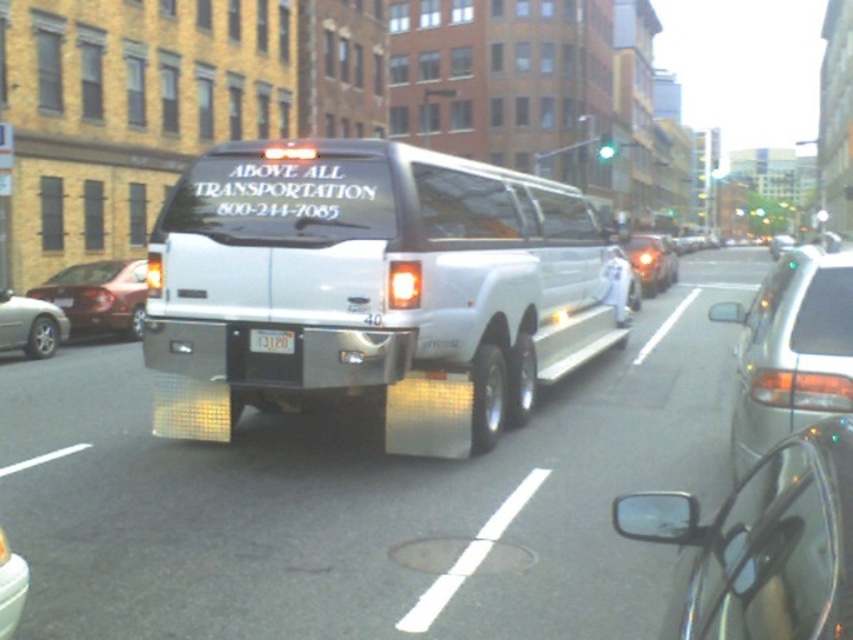
You are a delivery person who needs to load a tall package into one of the cars. Which car between the metallic silver sedan at right and the metallic red sedan at left would allow you to place the package without damaging the roof?

The metallic silver sedan at right has a greater height compared to the metallic red sedan at left, so it would allow you to place the tall package without damaging the roof.

You are a delivery person who needs to park your 2.5 meters tall delivery truck in this street. Looking at the white glossy limousine at center and the shiny chrome car at center, which vehicle should you use as a reference to ensure your truck won

The white glossy limousine at center is much taller than the shiny chrome car at center. Therefore, you should use the white glossy limousine at center as a reference since it is taller and more likely to indicate the minimum height clearance required for parking your 2.5 meters tall delivery truck.

You are a pedestrian standing in the middle of the street and see the metallic silver sedan at right and the metallic red sedan at left. Which car is closer to your right side?

The metallic silver sedan at right is closer to your right side because it is positioned to the right of the metallic red sedan at left.